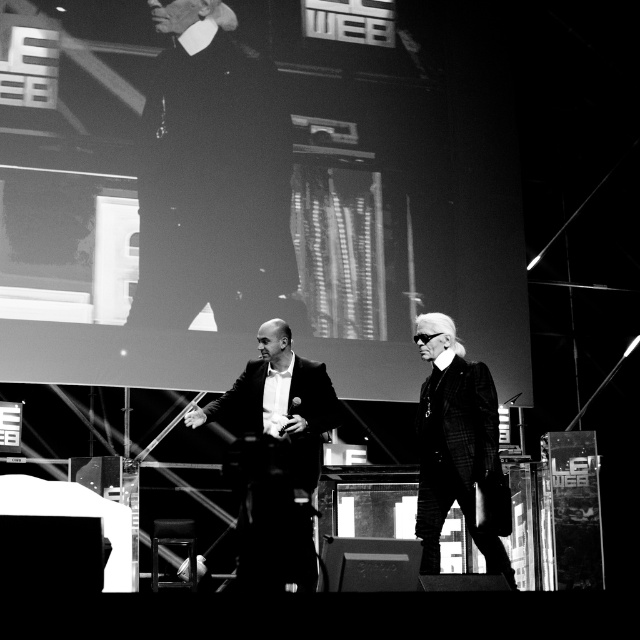
Question: In this image, where is dark velvet suit at upper left located relative to smooth black suit at center?

Choices:
 (A) above
 (B) below

Answer: (A)

Question: Which object is positioned closest to the smooth black suit at center?

Choices:
 (A) plaid wool business suit at right
 (B) dark velvet suit at upper left

Answer: (A)

Question: Based on their relative distances, which object is nearer to the plaid wool business suit at right?

Choices:
 (A) smooth black suit at center
 (B) dark velvet suit at upper left

Answer: (A)

Question: Which of the following is the farthest from the observer?

Choices:
 (A) (237, 76)
 (B) (433, 532)
 (C) (257, 385)

Answer: (A)

Question: Observing the image, what is the correct spatial positioning of smooth black suit at center in reference to plaid wool business suit at right?

Choices:
 (A) right
 (B) left

Answer: (B)

Question: Is smooth black suit at center to the left of plaid wool business suit at right from the viewer's perspective?

Choices:
 (A) yes
 (B) no

Answer: (A)